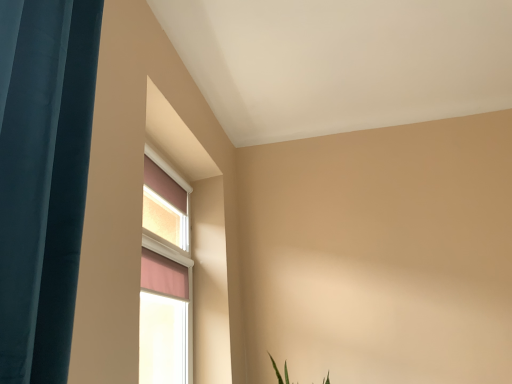
Question: Is pink fabric window at upper left closer to camera compared to teal fabric curtain at left?

Choices:
 (A) yes
 (B) no

Answer: (B)

Question: Is pink fabric window at upper left oriented away from teal fabric curtain at left?

Choices:
 (A) yes
 (B) no

Answer: (B)

Question: Considering the relative sizes of pink fabric window at upper left and teal fabric curtain at left in the image provided, is pink fabric window at upper left taller than teal fabric curtain at left?

Choices:
 (A) no
 (B) yes

Answer: (B)

Question: Is pink fabric window at upper left aimed at teal fabric curtain at left?

Choices:
 (A) yes
 (B) no

Answer: (B)

Question: Can you confirm if pink fabric window at upper left is positioned to the right of teal fabric curtain at left?

Choices:
 (A) yes
 (B) no

Answer: (A)

Question: Are pink fabric window at upper left and teal fabric curtain at left making contact?

Choices:
 (A) no
 (B) yes

Answer: (A)

Question: Would you say pink fabric window at upper left is part of teal fabric curtain at left's contents?

Choices:
 (A) no
 (B) yes

Answer: (A)

Question: Can you see teal fabric curtain at left touching pink fabric window at upper left?

Choices:
 (A) yes
 (B) no

Answer: (B)

Question: Considering the relative sizes of teal fabric curtain at left and pink fabric window at upper left in the image provided, is teal fabric curtain at left smaller than pink fabric window at upper left?

Choices:
 (A) yes
 (B) no

Answer: (B)

Question: Is teal fabric curtain at left positioned beyond the bounds of pink fabric window at upper left?

Choices:
 (A) yes
 (B) no

Answer: (A)

Question: Is teal fabric curtain at left taller than pink fabric window at upper left?

Choices:
 (A) yes
 (B) no

Answer: (B)

Question: Is teal fabric curtain at left positioned behind pink fabric window at upper left?

Choices:
 (A) no
 (B) yes

Answer: (A)

Question: From a real-world perspective, is teal fabric curtain at left positioned above or below pink fabric window at upper left?

Choices:
 (A) above
 (B) below

Answer: (A)